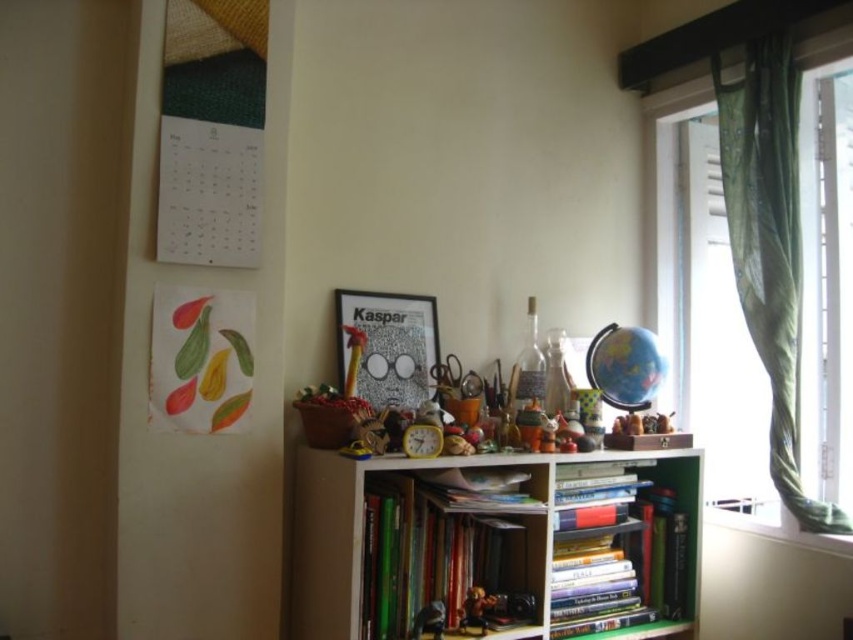
Question: Which point is closer to the camera taking this photo?

Choices:
 (A) (376, 317)
 (B) (376, 481)
 (C) (567, 573)
 (D) (480, 588)

Answer: (B)

Question: Does hardcover books at center come behind metallic gold figurine at center?

Choices:
 (A) no
 (B) yes

Answer: (B)

Question: Which point is farther to the camera?

Choices:
 (A) (398, 381)
 (B) (717, 104)
 (C) (482, 602)

Answer: (B)

Question: Can you confirm if hardcover book at center is smaller than metallic gold figurine at center?

Choices:
 (A) no
 (B) yes

Answer: (A)

Question: Which point appears closest to the camera in this image?

Choices:
 (A) (635, 579)
 (B) (479, 596)
 (C) (366, 509)
 (D) (312, 557)

Answer: (C)

Question: Considering the relative positions of wooden bookshelf at center and green sheer curtain at right in the image provided, where is wooden bookshelf at center located with respect to green sheer curtain at right?

Choices:
 (A) right
 (B) left

Answer: (B)